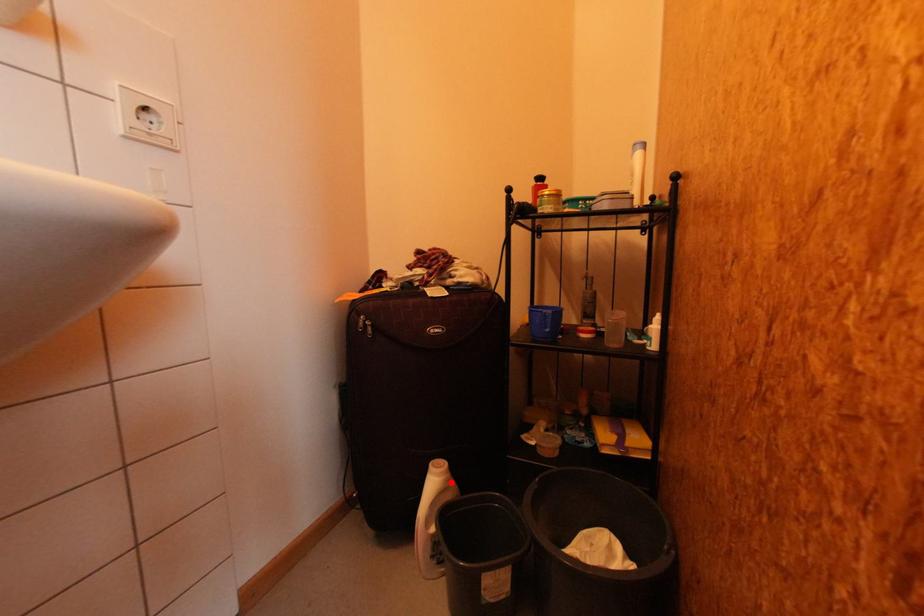
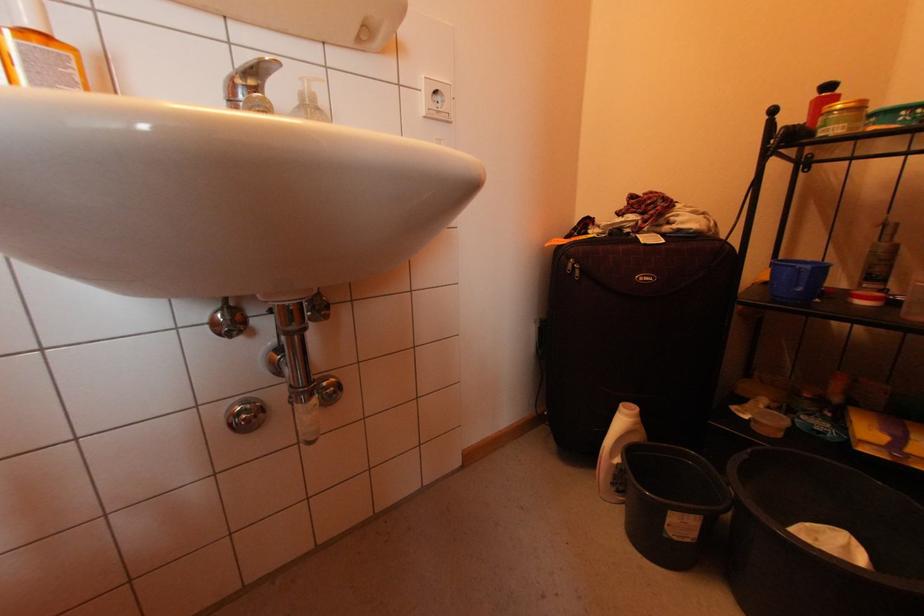
In the second image, find the point that corresponds to the highlighted location in the first image.

(640, 424)